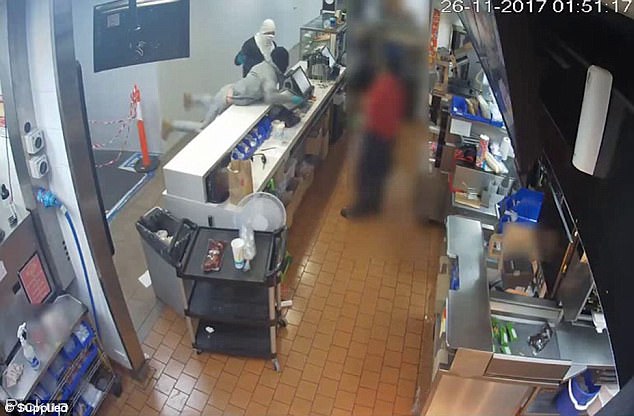
Locate an element on the screen. blue bucket is located at coordinates (574, 395).